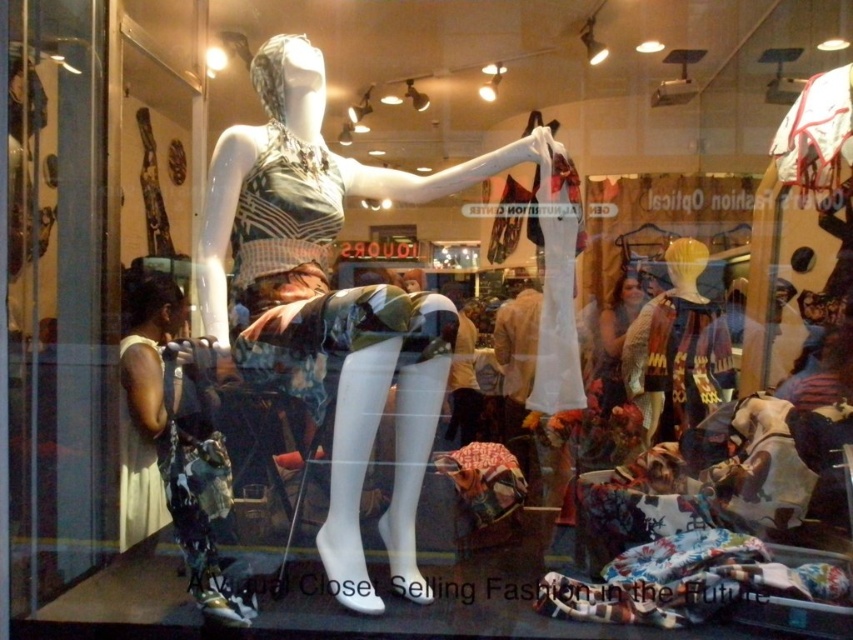
Question: Does matte white mannequin at center appear on the right side of matte gold necklace at center?

Choices:
 (A) yes
 (B) no

Answer: (B)

Question: Which point appears closest to the camera in this image?

Choices:
 (A) (300, 262)
 (B) (148, 452)
 (C) (167, 307)
 (D) (712, 401)

Answer: (A)

Question: Can you confirm if matte white mannequin at center is positioned to the left of matte gold necklace at center?

Choices:
 (A) yes
 (B) no

Answer: (A)

Question: In this image, where is printed fabric dress at left located relative to textured beige scarf at center?

Choices:
 (A) below
 (B) above

Answer: (A)

Question: Which point is closer to the camera?

Choices:
 (A) pyautogui.click(x=140, y=444)
 (B) pyautogui.click(x=612, y=330)
 (C) pyautogui.click(x=183, y=352)
 (D) pyautogui.click(x=421, y=298)

Answer: (C)

Question: Which point is farther from the camera taking this photo?

Choices:
 (A) (149, 403)
 (B) (314, 211)
 (C) (660, 401)

Answer: (C)